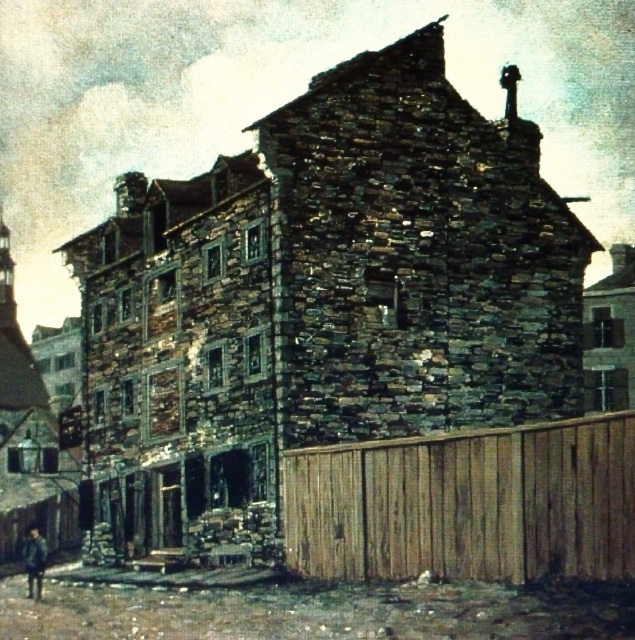
Question: Which point is closer to the camera?

Choices:
 (A) (30, 570)
 (B) (488, 435)

Answer: (B)

Question: Is brown wooden fence at right thinner than dark blue jacket at lower left?

Choices:
 (A) yes
 (B) no

Answer: (B)

Question: Is brown wooden fence at right closer to the viewer compared to dark blue jacket at lower left?

Choices:
 (A) yes
 (B) no

Answer: (A)

Question: Among these points, which one is nearest to the camera?

Choices:
 (A) (471, 464)
 (B) (41, 556)

Answer: (A)

Question: Is brown wooden fence at right above dark blue jacket at lower left?

Choices:
 (A) yes
 (B) no

Answer: (A)